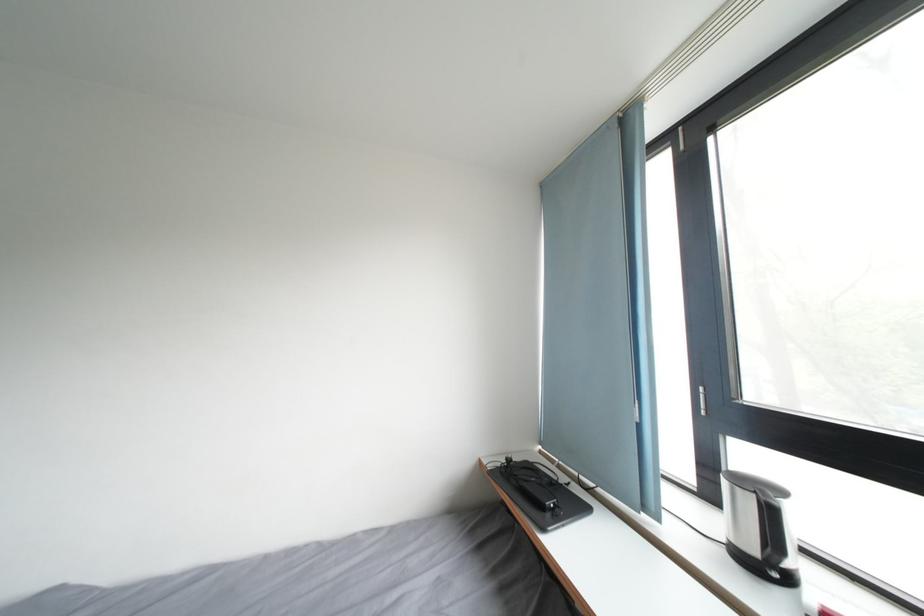
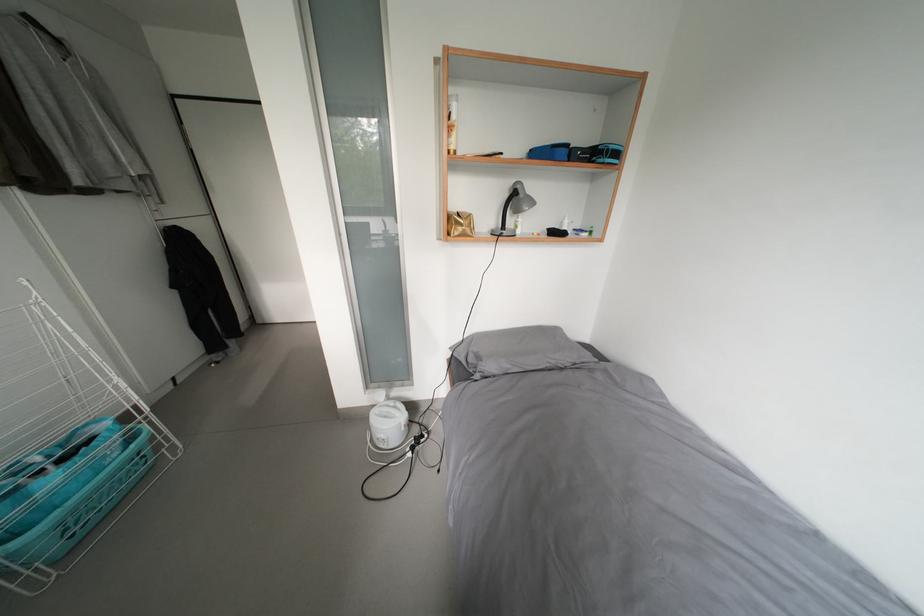
Based on the continuous images, in which direction is the camera rotating?

The camera rotated toward left-down.